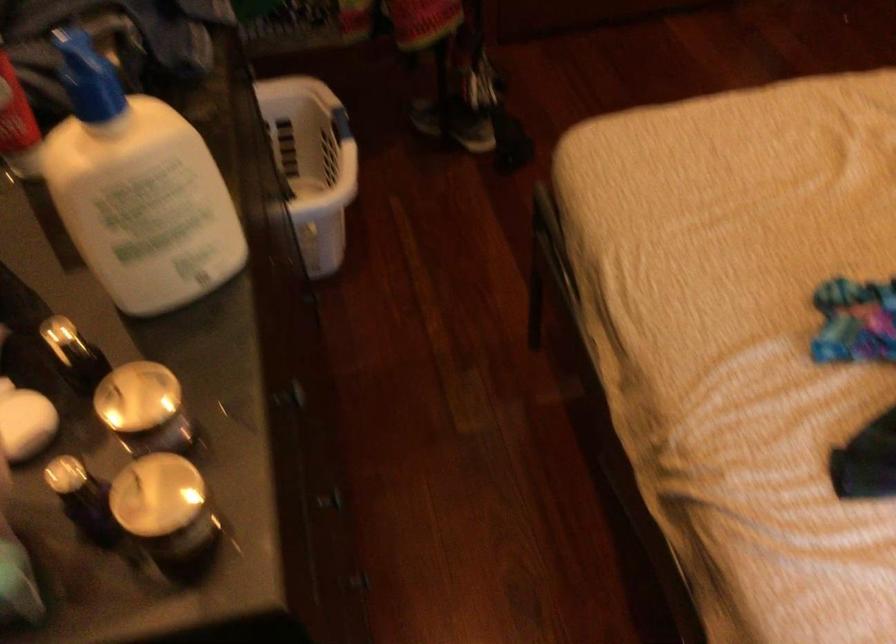
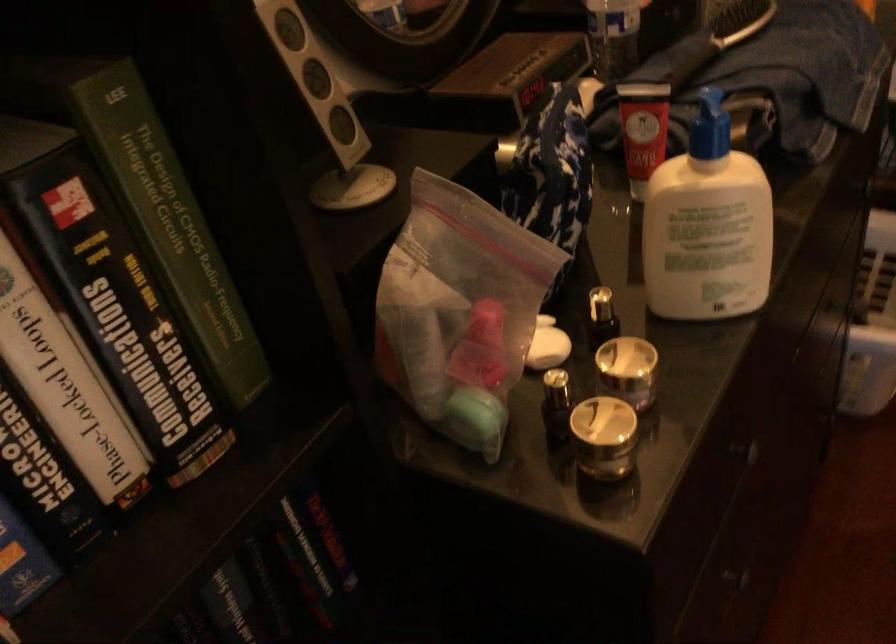
Locate, in the second image, the point that corresponds to point 99,73 in the first image.

(709, 126)